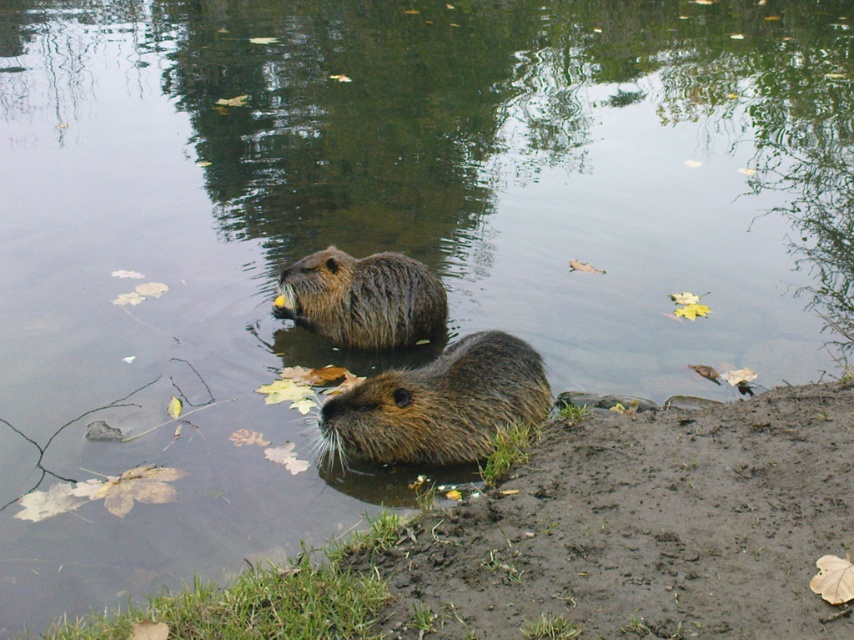
You are observing two otters in a pond. You notice a fuzzy brown otter at lower center and a brown fuzzy otter at center. Which otter is larger?

The fuzzy brown otter at lower center is bigger than the brown fuzzy otter at center.

You are a photographer standing at the shoreline. You want to take a photo of both point (428, 403) and point (344, 288). Which point should you focus on first to ensure both are in the frame?

Point (428, 403) is in front of point (344, 288), so you should focus on point (428, 403) first to ensure both are in the frame.

You are a wildlife photographer aiming to capture a closeup shot of the brown fuzzy otter at center while avoiding the brown fluffy mud at lower center. Given that your camera lens has a minimum focus distance of 2 meters, can you take the photo without moving closer than the required distance?

The brown fluffy mud at lower center and brown fuzzy otter at center are 1.93 meters apart from each other. Since the minimum focus distance is 2 meters, you cannot take the photo without moving closer than the required distance because the distance between them is less than 2 meters.